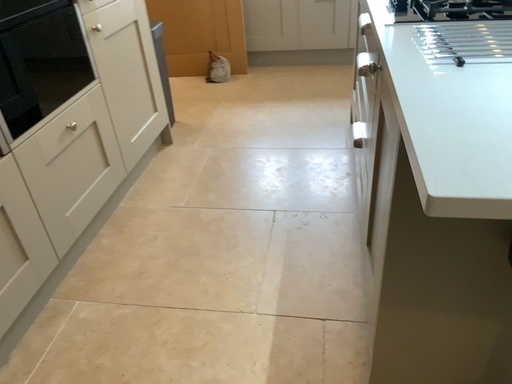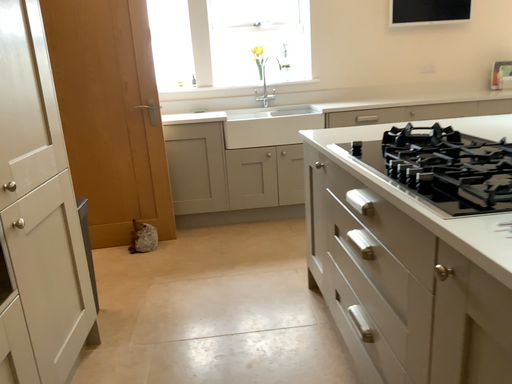
Question: How did the camera likely rotate when shooting the video?

Choices:
 (A) rotated right
 (B) rotated left

Answer: (A)